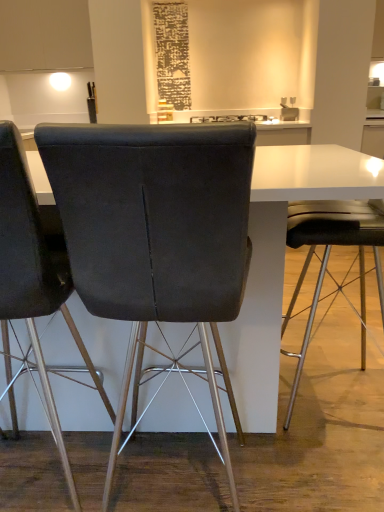
At what (x,y) coordinates should I click in order to perform the action: click on unoccupied space behind matte black chair at right, the 1th chair positioned from the right. Please return your answer as a coordinate pair (x, y). This screenshot has width=384, height=512. Looking at the image, I should click on (336, 342).